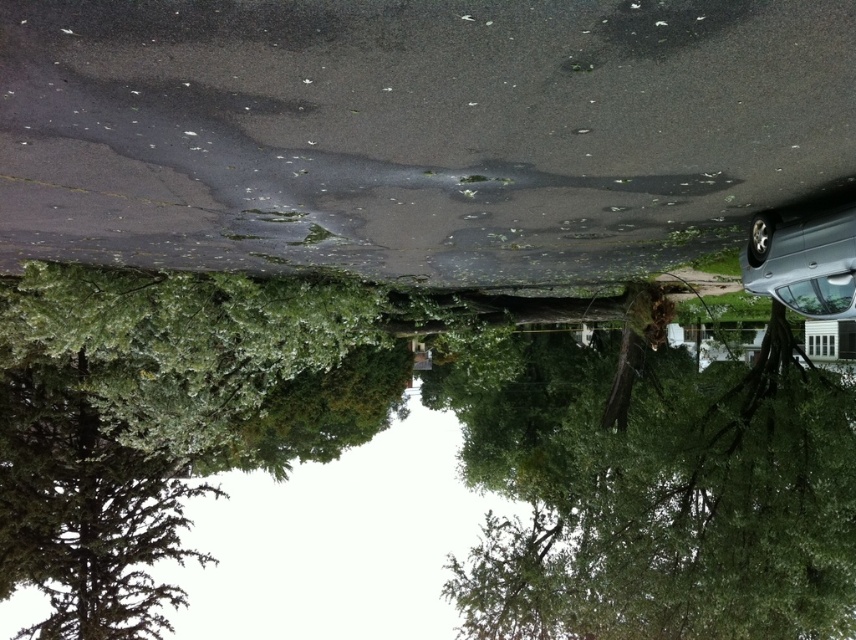
You are a drone operator trying to capture a photo of two specific points on the road. The first point is at point (801, 394) and the second is at point (146, 400). Given the rotated image where the road is horizontal, which point should you focus on first to ensure it appears closer in the photo?

Point (801, 394) is closer to the camera than point (146, 400), so you should focus on point (801, 394) first to ensure it appears closer in the photo.

You are a delivery drone flying over a wet road. You need to land on the silver metallic car at right without hitting the green leafy tree at center. What is the minimum horizontal distance you must maintain between the drone and the tree to safely land?

The minimum horizontal distance to maintain between the drone and the green leafy tree at center is 5.28 meters to safely land on the silver metallic car at right.

You are standing at the point marked as point (825, 560) in the rotated image. You want to walk to the parked car on the right side of the road. Is the parked car on the right side of the road within your line of sight from your current position?

The parked car on the right side of the road is within your line of sight because the distance between you and the point (825, 560) is 45.13 feet, which is a reasonable distance for visibility.